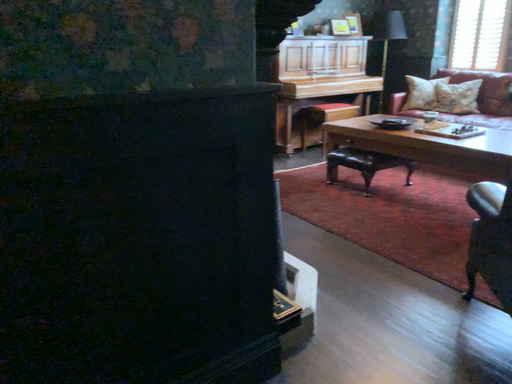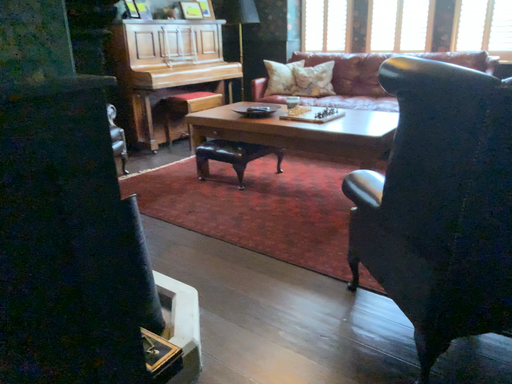
Question: How did the camera likely rotate when shooting the video?

Choices:
 (A) rotated right
 (B) rotated left

Answer: (A)